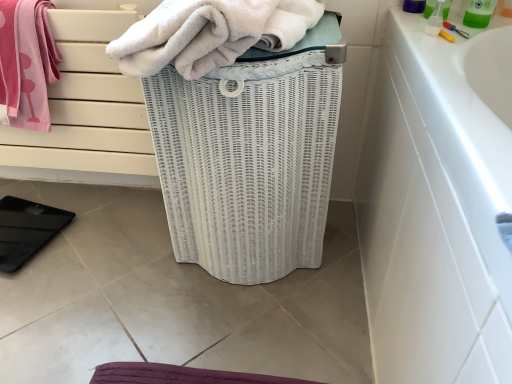
Question: From the image's perspective, is pink cotton towel at upper left, which is the 2th towel in right-to-left order, positioned above or below white fluffy towel at center, which appears as the 1th towel when viewed from the right?

Choices:
 (A) below
 (B) above

Answer: (A)

Question: From a real-world perspective, relative to white fluffy towel at center, which appears as the 1th towel when viewed from the right, is pink cotton towel at upper left, which is the 1th towel in left-to-right order, vertically above or below?

Choices:
 (A) below
 (B) above

Answer: (A)

Question: Based on their relative distances, which object is farther from the pink cotton towel at upper left, which is the 2th towel in right-to-left order?

Choices:
 (A) white wicker basket at center
 (B) green plastic bottle at upper right
 (C) white fluffy towel at center, arranged as the second towel when viewed from the left

Answer: (B)

Question: Which is farther from the white fluffy towel at center, arranged as the second towel when viewed from the left?

Choices:
 (A) green plastic bottle at upper right
 (B) white wicker basket at center
 (C) pink cotton towel at upper left, which is the 1th towel in left-to-right order

Answer: (A)